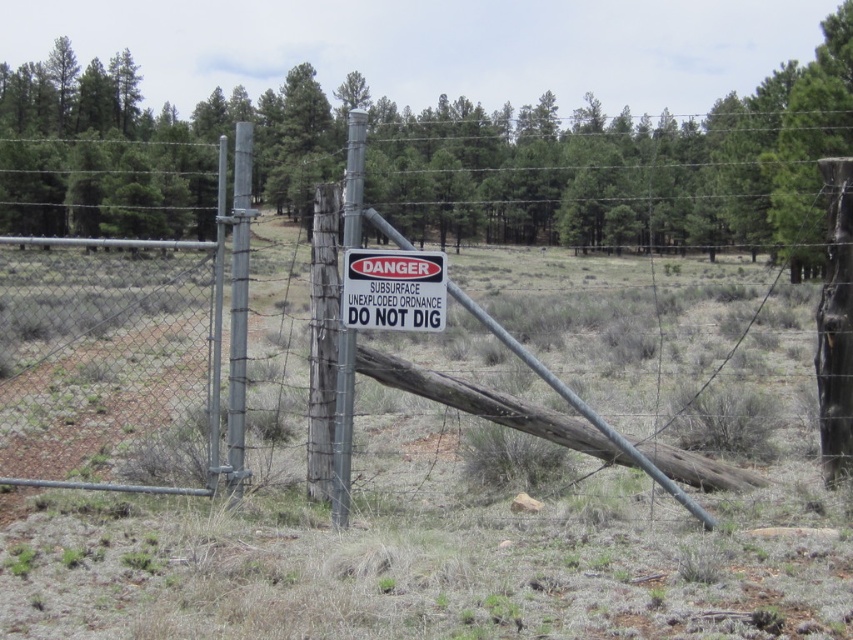
You are a surveyor standing at the point with coordinates point (248,168). You need to reach the point with coordinates point (363,301). Given the presence of the fence and the warning sign, what is the safest path to take?

The safest path would be to go around the fence and proceed towards point (363,301) while avoiding the restricted area marked by the warning sign.

From the picture: You are a maintenance worker assigned to replace the white plastic sign at center. The new sign is 12 inches wide. Can you safely remove the old sign without touching the metallic gray pole at center?

The distance between the white plastic sign at center and metallic gray pole at center is 13.05 inches, which is greater than the width of the new sign. Therefore, you can safely remove the old sign without touching the metallic gray pole at center.